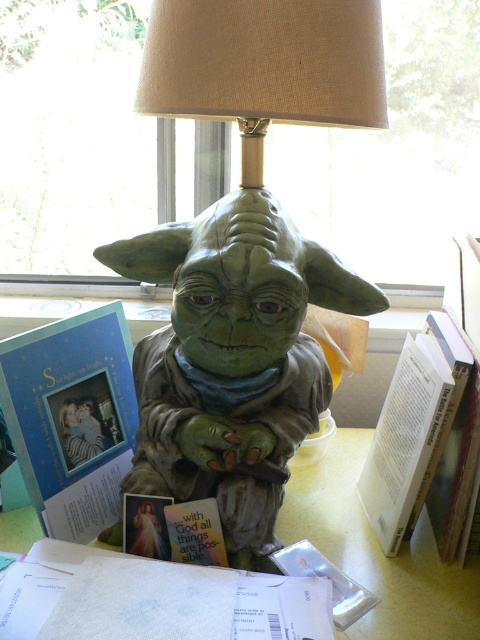
You are organizing a desk and need to place a new item between the green matte yoda statue at center and the white textured paper at lower center. Based on their sizes, which object should you place closer to the edge of the desk to ensure stability?

The white textured paper at lower center should be placed closer to the edge since it is shorter than the green matte yoda statue at center, making it less likely to tip over when positioned near the edge.

You are organizing a desk and need to place the green matte yoda statue at center and the matte blue card at left into a drawer that can only accommodate items up to 10 cm in width. Based on their widths, can both items fit side by side in the drawer?

The green matte yoda statue at center might be wider than the matte blue card at left, so it is uncertain if both can fit side by side in the drawer without exceeding the 10 cm width limit.

You are a photographer trying to capture a closeup shot of the green matte yoda statue at center. Your camera has a minimum focusing distance of 20 inches. Will you be able to move closer to the statue to take the photo without it becoming out of focus?

The distance between the green matte yoda statue at center and the camera is 30.15 inches. Since the minimum focusing distance is 20 inches, you can move closer to within 20 inches to take the photo while keeping it in focus.